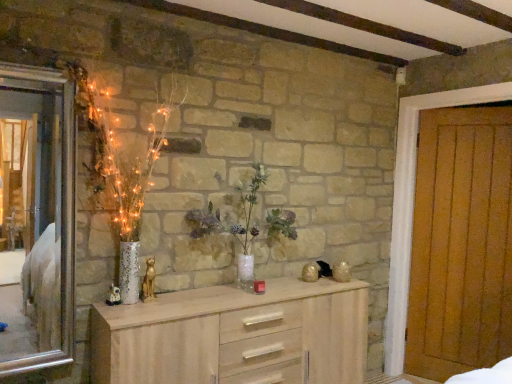
What are the coordinates of `vacant space in translucent glass vase at center (from a real-world perspective)` in the screenshot? It's located at (266, 278).